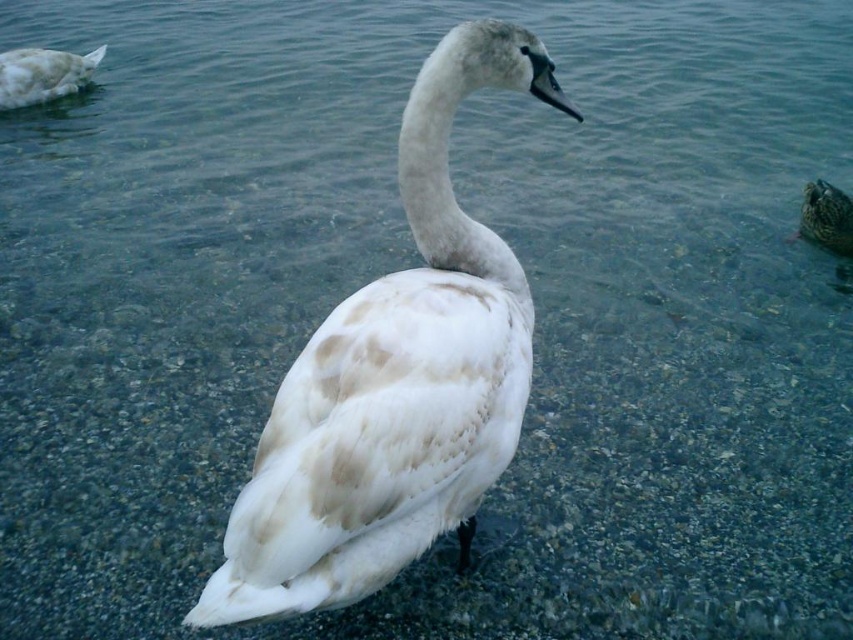
Is point (335, 486) positioned after point (38, 56)?

No, (335, 486) is in front of (38, 56).

Looking at this image, is white fluffy swan at center to the left of white fluffy duck at upper left from the viewer's perspective?

In fact, white fluffy swan at center is to the right of white fluffy duck at upper left.

The image size is (853, 640). What do you see at coordinates (393, 380) in the screenshot?
I see `white fluffy swan at center` at bounding box center [393, 380].

Locate an element on the screen. The width and height of the screenshot is (853, 640). white fluffy swan at center is located at coordinates (393, 380).

From the picture: Is white fluffy duck at upper left positioned at the back of speckled brown duck at right?

Yes.

Between point (51, 56) and point (846, 237), which one is positioned in front?

Point (846, 237) is in front.

The width and height of the screenshot is (853, 640). Describe the element at coordinates (44, 74) in the screenshot. I see `white fluffy duck at upper left` at that location.

At what (x,y) coordinates should I click in order to perform the action: click on white fluffy duck at upper left. Please return your answer as a coordinate pair (x, y). The height and width of the screenshot is (640, 853). Looking at the image, I should click on (44, 74).

Who is taller, white fluffy swan at center or speckled brown duck at right?

Standing taller between the two is white fluffy swan at center.

Between point (518, 284) and point (828, 230), which one is positioned in front?

Point (518, 284)

Is point (514, 262) positioned behind point (811, 234)?

No, (514, 262) is closer to viewer.

This screenshot has width=853, height=640. What are the coordinates of `white fluffy swan at center` in the screenshot? It's located at point(393,380).